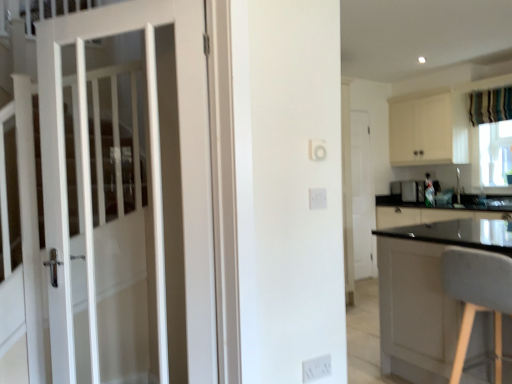
Question: From a real-world perspective, is gray fabric chair at right physically located above or below white matte door at center, arranged as the 1th door when viewed from the back?

Choices:
 (A) above
 (B) below

Answer: (B)

Question: Considering their positions, is gray fabric chair at right located in front of or behind white matte door at center, the 2th door positioned from the left?

Choices:
 (A) front
 (B) behind

Answer: (A)

Question: Which is farther from the metallic silver toaster at right?

Choices:
 (A) white plastic electric outlet at lower center
 (B) white matte door at center, marked as the 2th door in a front-to-back arrangement
 (C) striped fabric curtain at upper right
 (D) gray fabric chair at right
 (E) transparent plastic window screen at right

Answer: (A)

Question: Which is farther from the white wooden door at left, which is counted as the 1th door, starting from the front?

Choices:
 (A) white plastic electric outlet at lower center
 (B) striped fabric curtain at upper right
 (C) white matte door at center, the 1th door viewed from the right
 (D) transparent plastic window screen at right
 (E) metallic silver toaster at right

Answer: (E)